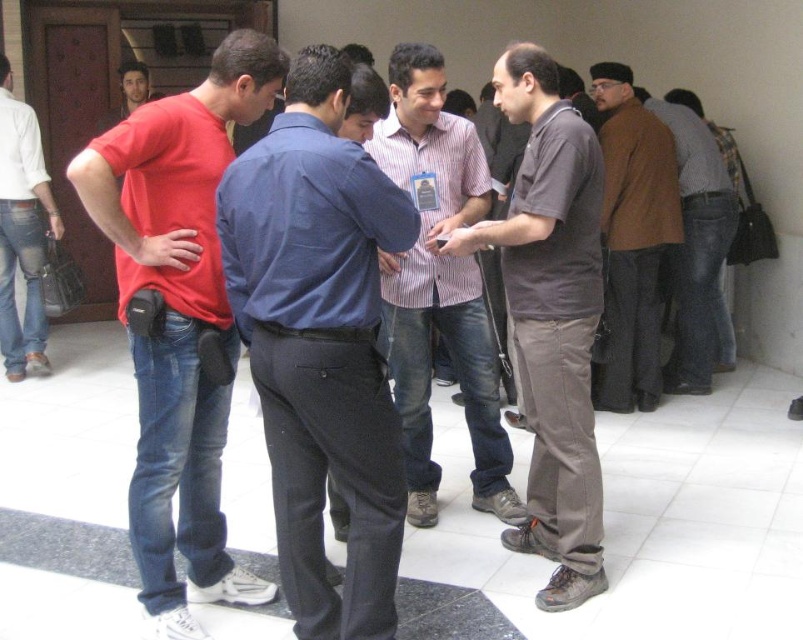
You are organizing a clothing donation drive and need to categorize shirts by size. You have two shirts in front of you, the blue shirt at center and the striped cotton shirt at center. Which shirt should you place in the small size bin?

The blue shirt at center is thinner than the striped cotton shirt at center, so the blue shirt at center should be placed in the small size bin.

You are organizing a photo shoot and need to arrange two models wearing the blue shirt at center and the striped cotton shirt at center. Based on their sizes, which model should stand in front to ensure both are visible in the frame?

The blue shirt at center should stand in front because it occupies less space than the striped cotton shirt at center, allowing both to be visible in the frame.